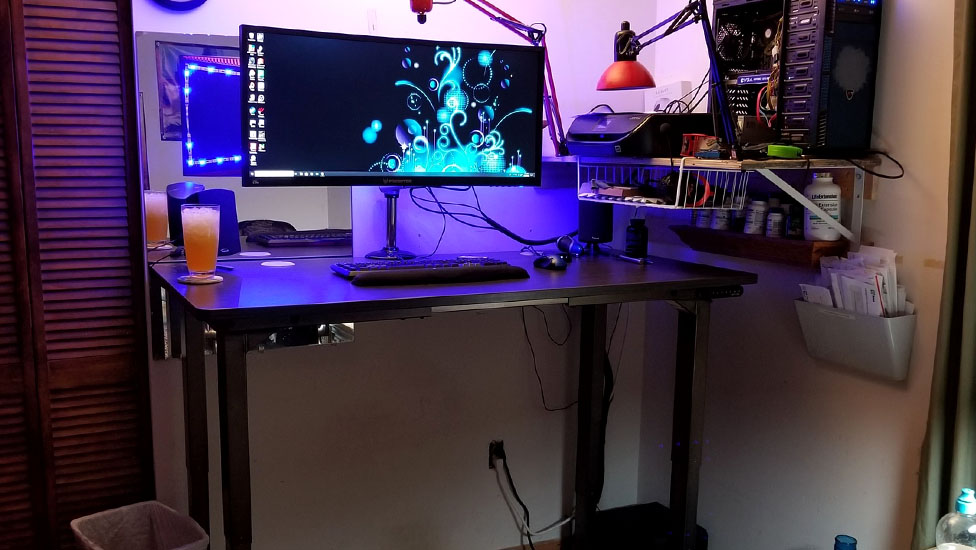
The width and height of the screenshot is (976, 550). I want to click on cup, so click(201, 257).